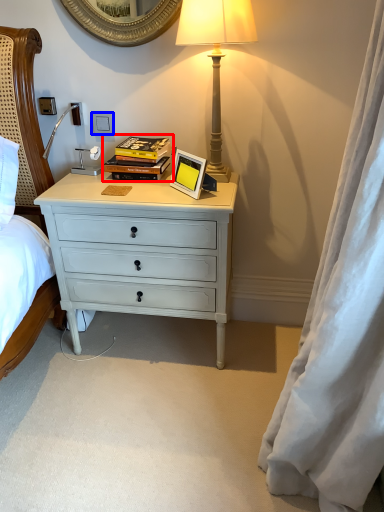
Question: Which object appears closest to the camera in this image, book (highlighted by a red box) or power outlet (highlighted by a blue box)?

Choices:
 (A) book
 (B) power outlet

Answer: (A)